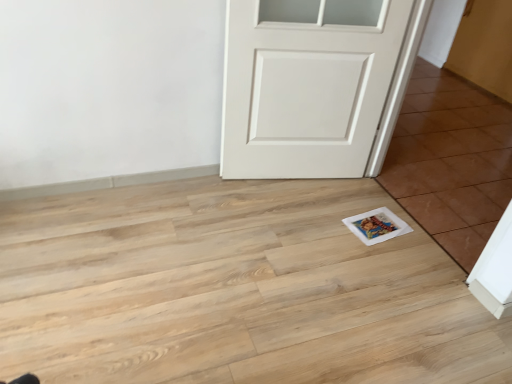
Question: In the image, is white painted wood door at center positioned in front of or behind white glossy tile at lower right?

Choices:
 (A) behind
 (B) front

Answer: (A)

Question: Would you say white painted wood door at center is inside or outside white glossy tile at lower right?

Choices:
 (A) outside
 (B) inside

Answer: (A)

Question: In terms of size, does white painted wood door at center appear bigger or smaller than white glossy tile at lower right?

Choices:
 (A) small
 (B) big

Answer: (B)

Question: Considering the relative positions of white glossy tile at lower right and white painted wood door at center in the image provided, is white glossy tile at lower right to the left or to the right of white painted wood door at center?

Choices:
 (A) right
 (B) left

Answer: (A)

Question: Is white glossy tile at lower right taller or shorter than white painted wood door at center?

Choices:
 (A) short
 (B) tall

Answer: (A)

Question: Considering the positions of white glossy tile at lower right and white painted wood door at center in the image, is white glossy tile at lower right bigger or smaller than white painted wood door at center?

Choices:
 (A) small
 (B) big

Answer: (A)

Question: From the image's perspective, is white glossy tile at lower right located above or below white painted wood door at center?

Choices:
 (A) above
 (B) below

Answer: (B)